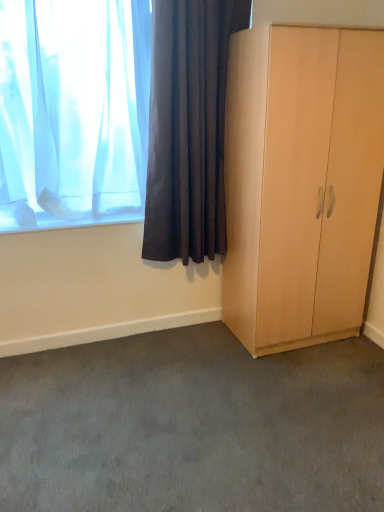
Locate an element on the screen. free spot in front of light wood wardrobe at right is located at coordinates (303, 384).